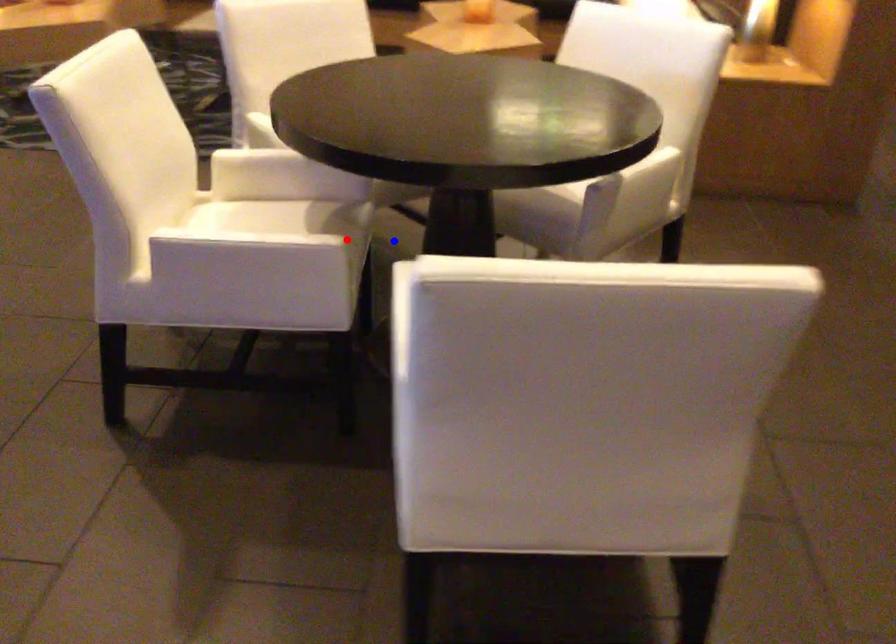
Question: Two points are marked on the image. Which point is closer to the camera?

Choices:
 (A) Blue point is closer.
 (B) Red point is closer.

Answer: (B)